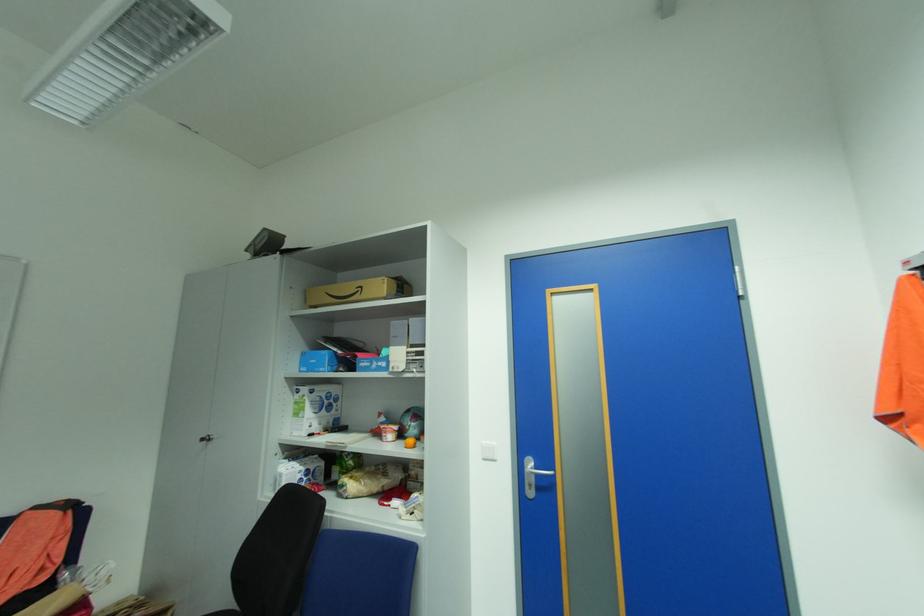
Where would you lift the blue cardboard box? Please return your answer as a coordinate pair (x, y).

(317, 361)